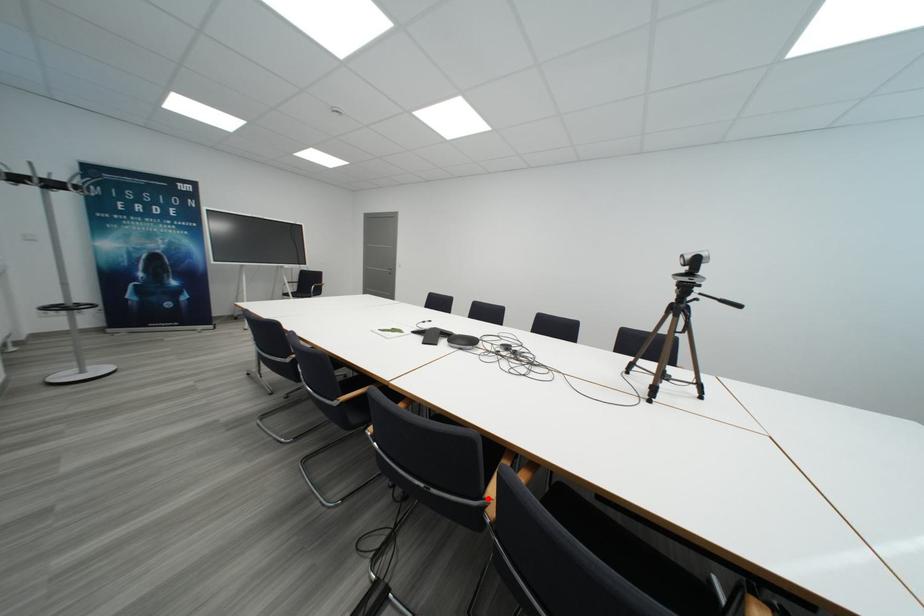
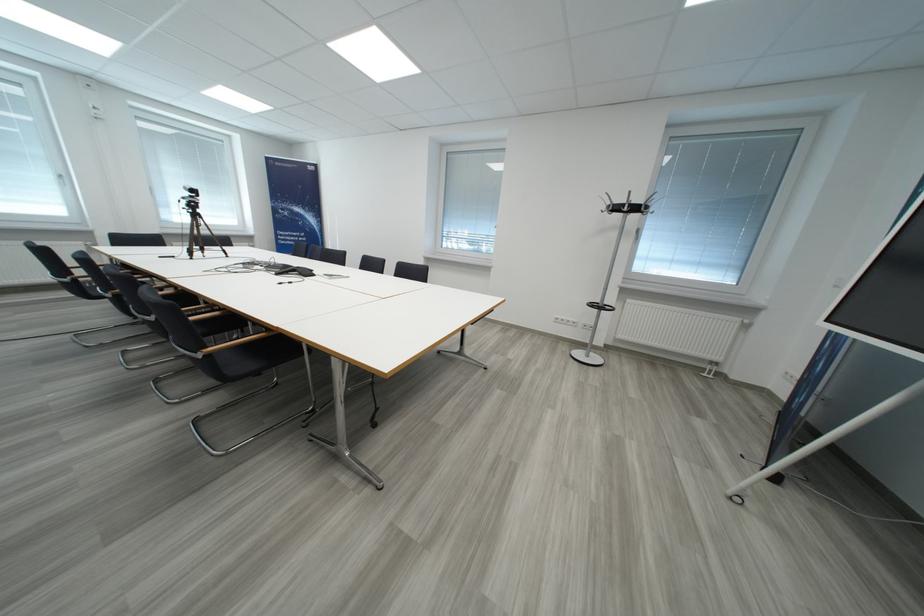
Question: I am providing you with two images of the same scene from different viewpoints. A red point is marked on the first image. At the location where the point appears in image 1, is it still visible in image 2?

Choices:
 (A) Yes
 (B) No

Answer: (B)